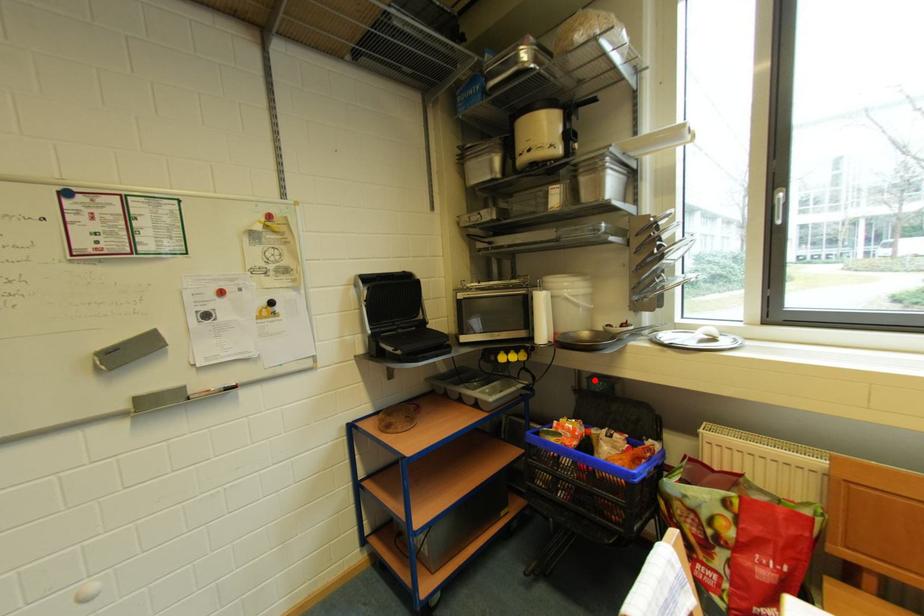
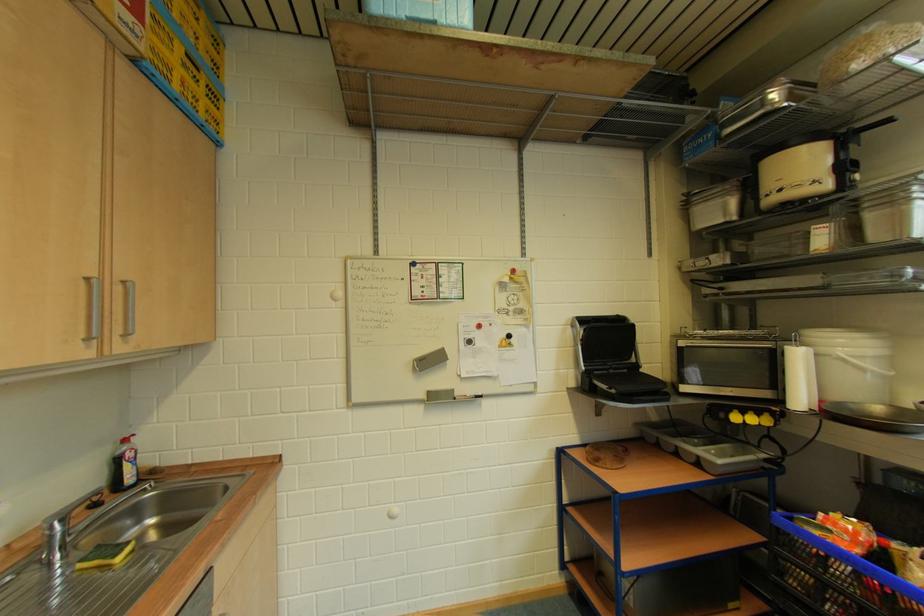
Locate, in the second image, the point that corresponds to the highlighted location in the first image.

(891, 472)